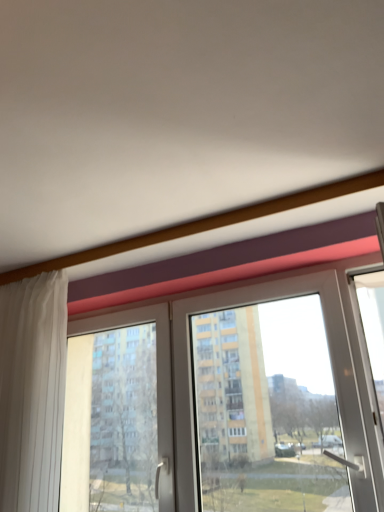
Question: In the image, is transparent glass window at center positioned in front of or behind white sheer curtain at left?

Choices:
 (A) behind
 (B) front

Answer: (B)

Question: Is transparent glass window at center spatially inside white sheer curtain at left, or outside of it?

Choices:
 (A) inside
 (B) outside

Answer: (B)

Question: From a real-world perspective, is transparent glass window at center positioned above or below white sheer curtain at left?

Choices:
 (A) below
 (B) above

Answer: (A)

Question: Based on their sizes in the image, would you say white sheer curtain at left is bigger or smaller than transparent glass window at center?

Choices:
 (A) big
 (B) small

Answer: (B)

Question: Is white sheer curtain at left situated inside transparent glass window at center or outside?

Choices:
 (A) outside
 (B) inside

Answer: (B)

Question: Relative to transparent glass window at center, is white sheer curtain at left in front or behind?

Choices:
 (A) behind
 (B) front

Answer: (A)

Question: Considering the positions of white sheer curtain at left and transparent glass window at center in the image, is white sheer curtain at left wider or thinner than transparent glass window at center?

Choices:
 (A) thin
 (B) wide

Answer: (A)